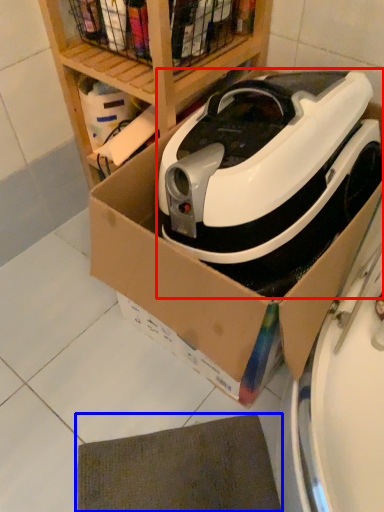
Question: Which object is further to the camera taking this photo, home appliance (highlighted by a red box) or mat (highlighted by a blue box)?

Choices:
 (A) home appliance
 (B) mat

Answer: (B)